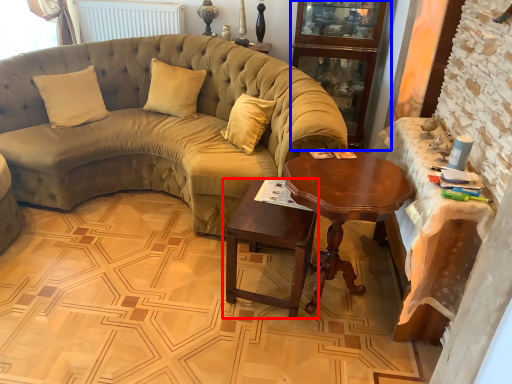
Question: Which object appears farthest to the camera in this image, table (highlighted by a red box) or bookshelf (highlighted by a blue box)?

Choices:
 (A) table
 (B) bookshelf

Answer: (B)